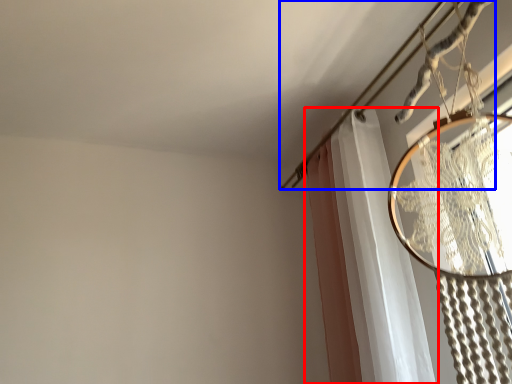
Question: Which object appears closest to the camera in this image, curtain (highlighted by a red box) or clothesline (highlighted by a blue box)?

Choices:
 (A) curtain
 (B) clothesline

Answer: (B)